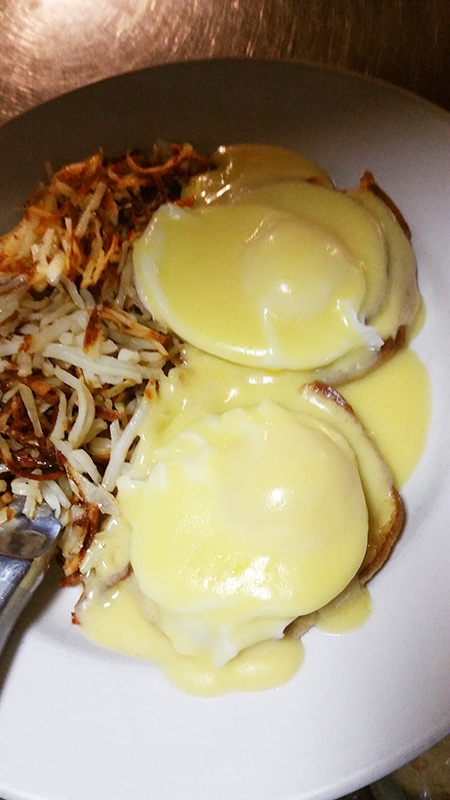
In order to click on table in this screenshot , I will do click(415, 778), click(384, 21), click(130, 50).